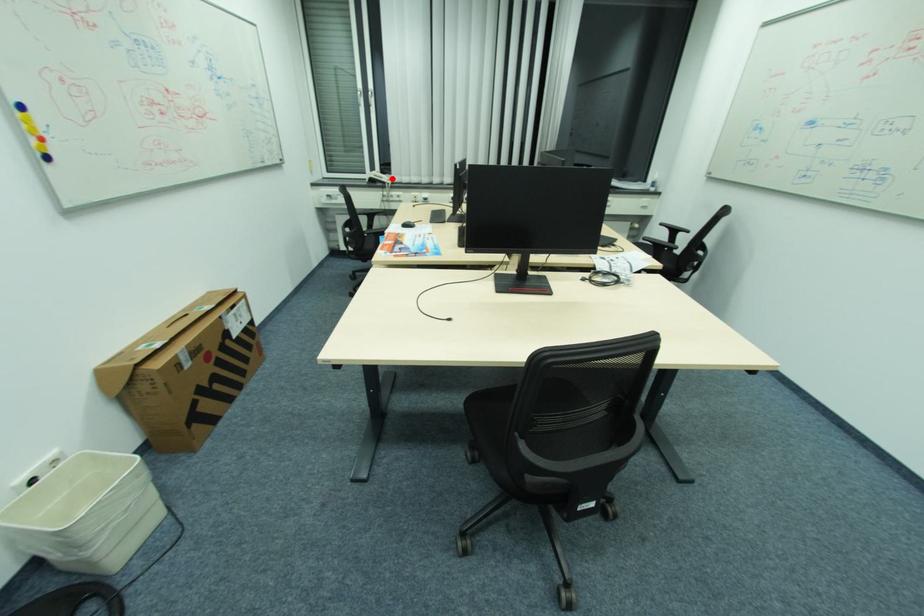
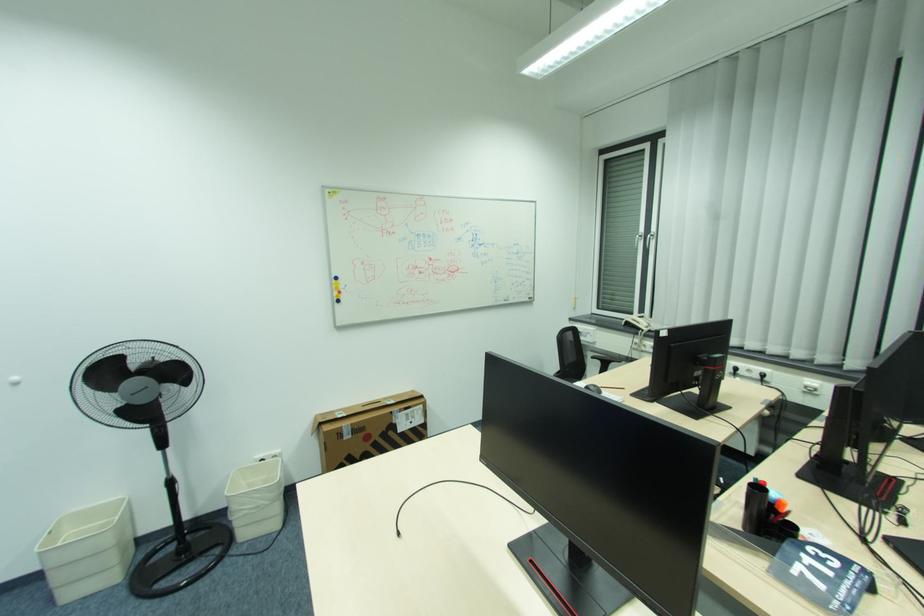
Question: I am providing you with two images of the same scene from different viewpoints. Image1 has a red point marked. In image2, the corresponding 3D location appears at what relative position? Reply with the corresponding letter.

Choices:
 (A) Closer
 (B) Farther

Answer: (B)